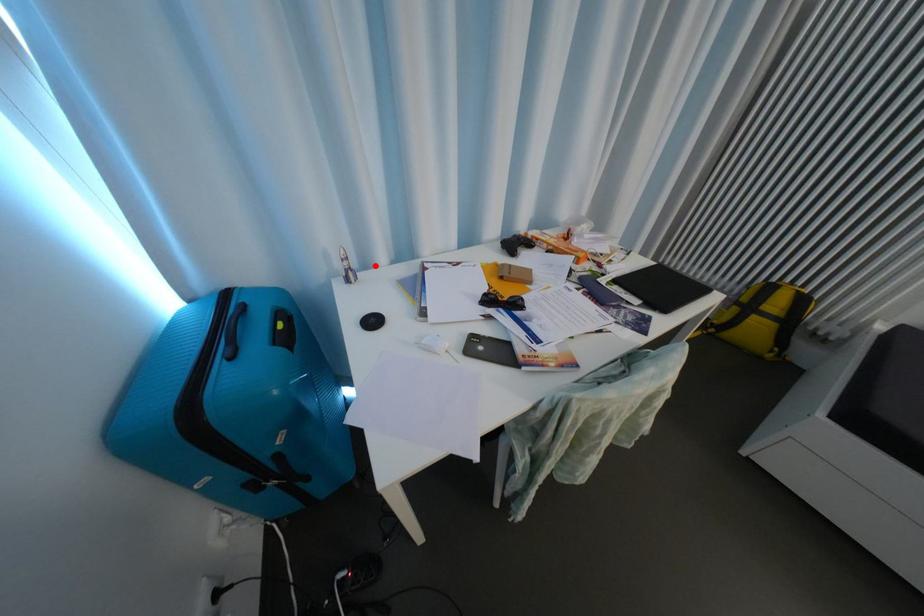
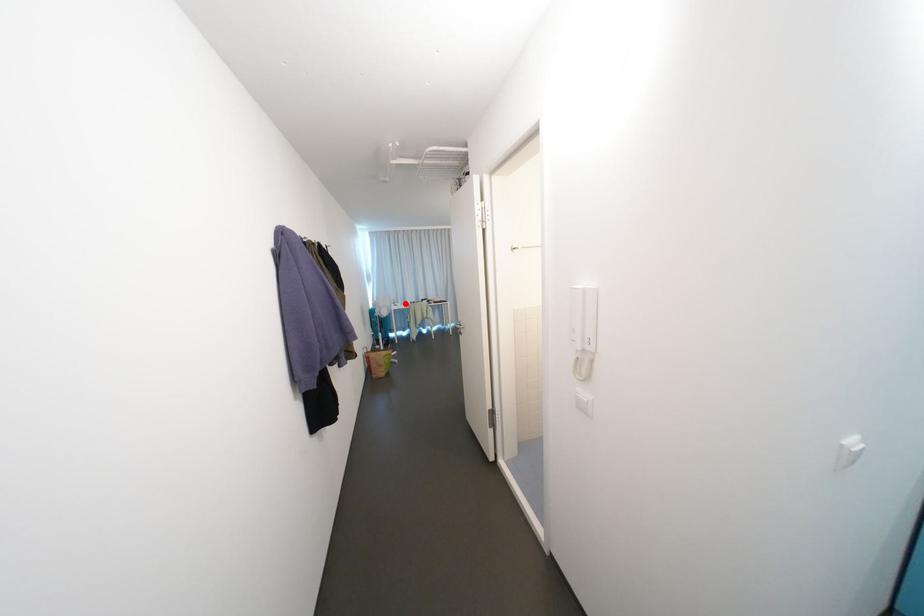
I am providing you with two images of the same scene from different viewpoints. A red point is marked on the first image and another point is marked on the second image. Are the points marked in image1 and image2 representing the same 3D position?

Yes